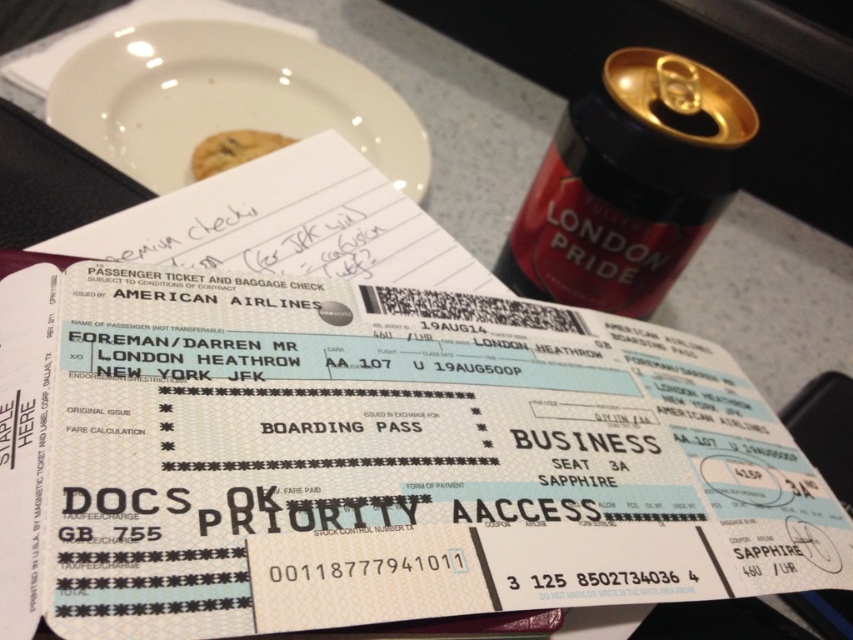
Question: Which of the following is the farthest from the observer?

Choices:
 (A) chocolate chip cookie at upper center
 (B) white glossy plate at upper center
 (C) red matte can at upper right

Answer: (A)

Question: Considering the relative positions of white glossy plate at upper center and chocolate chip cookie at upper center in the image provided, where is white glossy plate at upper center located with respect to chocolate chip cookie at upper center?

Choices:
 (A) left
 (B) right

Answer: (B)

Question: Which object appears closest to the camera in this image?

Choices:
 (A) red matte can at upper right
 (B) chocolate chip cookie at upper center

Answer: (A)

Question: Among these objects, which one is farthest from the camera?

Choices:
 (A) white glossy plate at upper center
 (B) red matte can at upper right

Answer: (A)

Question: Does red matte can at upper right come behind white glossy plate at upper center?

Choices:
 (A) yes
 (B) no

Answer: (B)

Question: Is red matte can at upper right smaller than chocolate chip cookie at upper center?

Choices:
 (A) no
 (B) yes

Answer: (A)